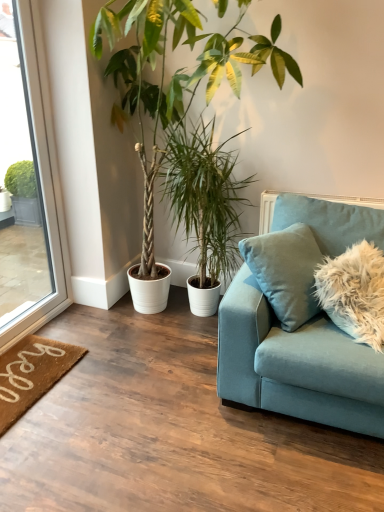
The height and width of the screenshot is (512, 384). Find the location of `free space on the front side of green leafy plant at center, placed as the 2th houseplant when sorted from left to right`. free space on the front side of green leafy plant at center, placed as the 2th houseplant when sorted from left to right is located at coordinates pyautogui.click(x=183, y=348).